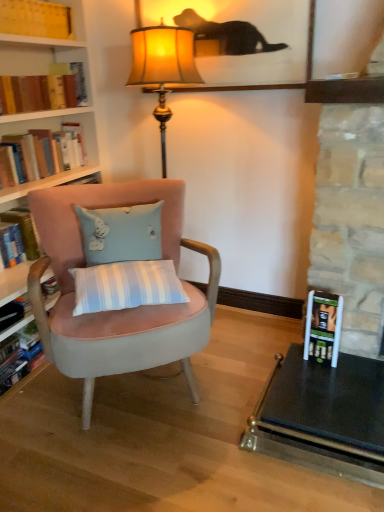
Question: From the image's perspective, is hardcover book at lower right positioned above or below yellow paper book at upper left, the fifth book in the bottom-to-top sequence?

Choices:
 (A) above
 (B) below

Answer: (B)

Question: Considering their positions, is hardcover book at lower right located in front of or behind yellow paper book at upper left, which ranks as the first book in top-to-bottom order?

Choices:
 (A) front
 (B) behind

Answer: (A)

Question: Estimate the real-world distances between objects in this image. Which object is closer to the hardcover book at left, which is counted as the first book, starting from the bottom?

Choices:
 (A) hardcover book at left, the 4th book viewed from the top
 (B) yellow paper book at upper left, the fifth book in the bottom-to-top sequence
 (C) hardcover books at left, positioned as the third book in top-to-bottom order
 (D) hardcover book at lower right
 (E) hardcover book at left, which ranks as the 4th book in bottom-to-top order

Answer: (A)

Question: Which object is positioned closest to the hardcover book at lower right?

Choices:
 (A) hardcover book at left, arranged as the second book when ordered from the bottom
 (B) hardcover books at left, the 3th book from the bottom
 (C) velvet pink chair at center
 (D) yellow paper book at upper left, which ranks as the first book in top-to-bottom order
 (E) hardcover book at left, the second book positioned from the top

Answer: (C)